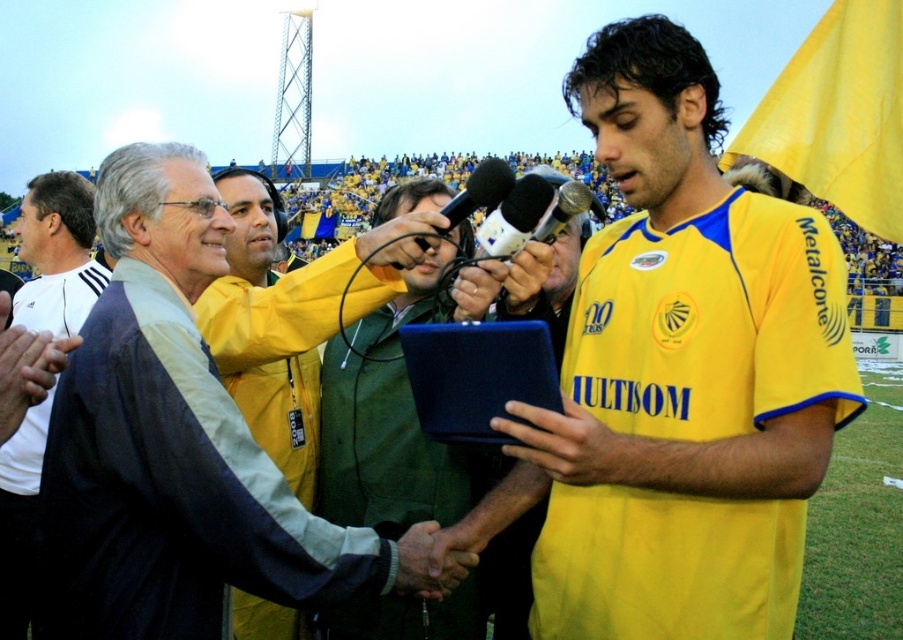
You are a GUI agent. You are given a task and a screenshot of the screen. Output one action in this format:
    pyautogui.click(x=<x>, y=<y>)
    Task: Click on the yellow jersey at center
    The width and height of the screenshot is (903, 640).
    Given the screenshot: What is the action you would take?
    pyautogui.click(x=683, y=372)

Does yellow jersey at center have a smaller size compared to green fabric jacket at center?

No, yellow jersey at center is not smaller than green fabric jacket at center.

Is point (608, 596) more distant than point (447, 499)?

No.

Identify the location of yellow jersey at center. (683, 372).

Does point (435, 182) come behind point (16, 438)?

That is True.

This screenshot has height=640, width=903. What do you see at coordinates (399, 406) in the screenshot? I see `green fabric jacket at center` at bounding box center [399, 406].

Is point (431, 262) positioned before point (71, 304)?

Yes, it is.

Where is `green fabric jacket at center`? This screenshot has height=640, width=903. green fabric jacket at center is located at coordinates (399, 406).

Who is positioned more to the left, yellow jersey at center or metallic microphones at center?

Positioned to the left is metallic microphones at center.

Is point (617, 362) closer to camera compared to point (497, 246)?

Yes.

Where is `yellow jersey at center`? This screenshot has height=640, width=903. yellow jersey at center is located at coordinates (683, 372).